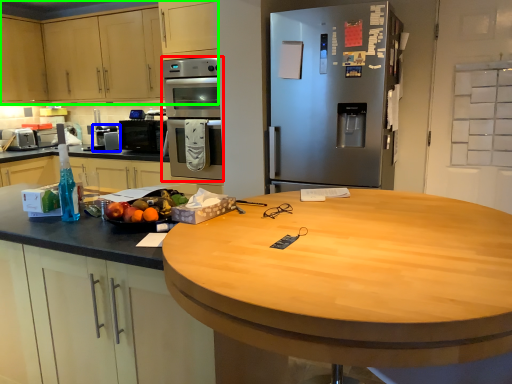
Question: Which is nearer to the oven (highlighted by a red box)? appliance (highlighted by a blue box) or cabinetry (highlighted by a green box).

Choices:
 (A) appliance
 (B) cabinetry

Answer: (B)